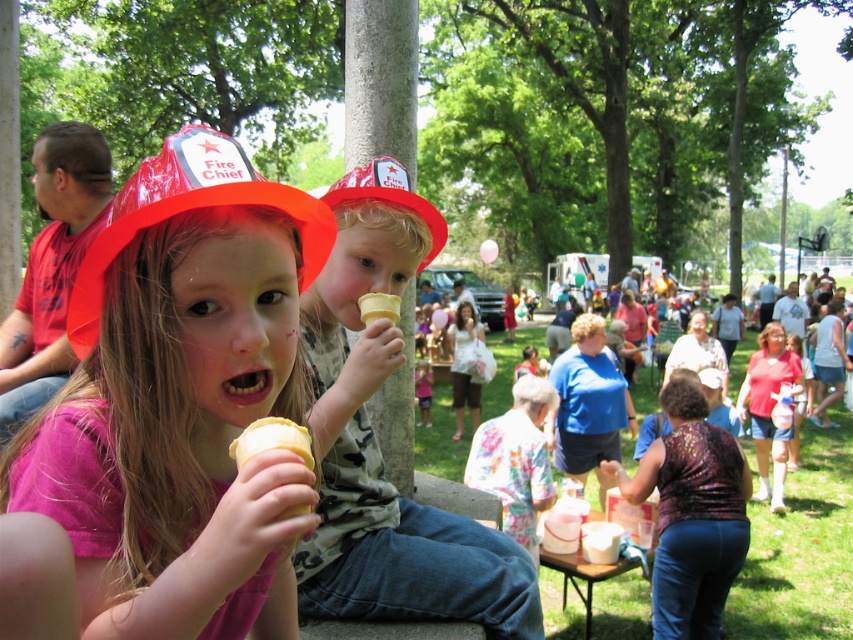
You are a photographer standing at the center of the park. You want to take a photo of the matte plastic fire chief hat at left. What are the coordinates of the hat relative to your position?

The matte plastic fire chief hat at left is located at coordinates point (181, 401) relative to your position.